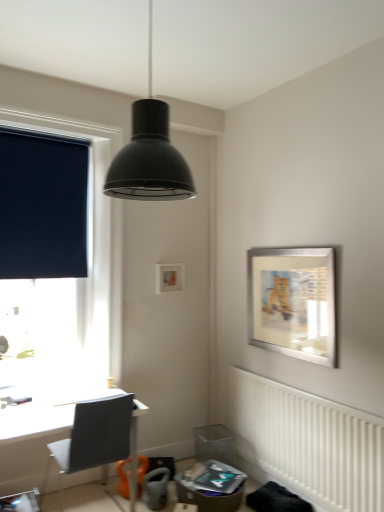
Question: Is dark blue fabric at left a part of matte black pendant light at upper center?

Choices:
 (A) yes
 (B) no

Answer: (B)

Question: From a real-world perspective, is matte black pendant light at upper center over dark blue fabric at left?

Choices:
 (A) yes
 (B) no

Answer: (A)

Question: Is matte black pendant light at upper center oriented towards dark blue fabric at left?

Choices:
 (A) yes
 (B) no

Answer: (B)

Question: From the image's perspective, would you say matte black pendant light at upper center is positioned over dark blue fabric at left?

Choices:
 (A) no
 (B) yes

Answer: (B)

Question: Does matte black pendant light at upper center come in front of dark blue fabric at left?

Choices:
 (A) yes
 (B) no

Answer: (A)

Question: Does matte black pendant light at upper center have a larger size compared to dark blue fabric at left?

Choices:
 (A) yes
 (B) no

Answer: (B)

Question: Is matte black pendant light at upper center bigger than dark blue roller blind at left?

Choices:
 (A) no
 (B) yes

Answer: (A)

Question: Is matte black pendant light at upper center wider than dark blue roller blind at left?

Choices:
 (A) no
 (B) yes

Answer: (B)

Question: Considering the relative sizes of matte black pendant light at upper center and dark blue roller blind at left in the image provided, is matte black pendant light at upper center smaller than dark blue roller blind at left?

Choices:
 (A) no
 (B) yes

Answer: (B)

Question: Would you consider matte black pendant light at upper center to be distant from dark blue roller blind at left?

Choices:
 (A) yes
 (B) no

Answer: (A)

Question: Are matte black pendant light at upper center and dark blue roller blind at left making contact?

Choices:
 (A) yes
 (B) no

Answer: (B)

Question: From a real-world perspective, is matte black pendant light at upper center positioned over dark blue roller blind at left based on gravity?

Choices:
 (A) no
 (B) yes

Answer: (B)

Question: Is dark blue roller blind at left not within white textured radiator at lower right?

Choices:
 (A) yes
 (B) no

Answer: (A)